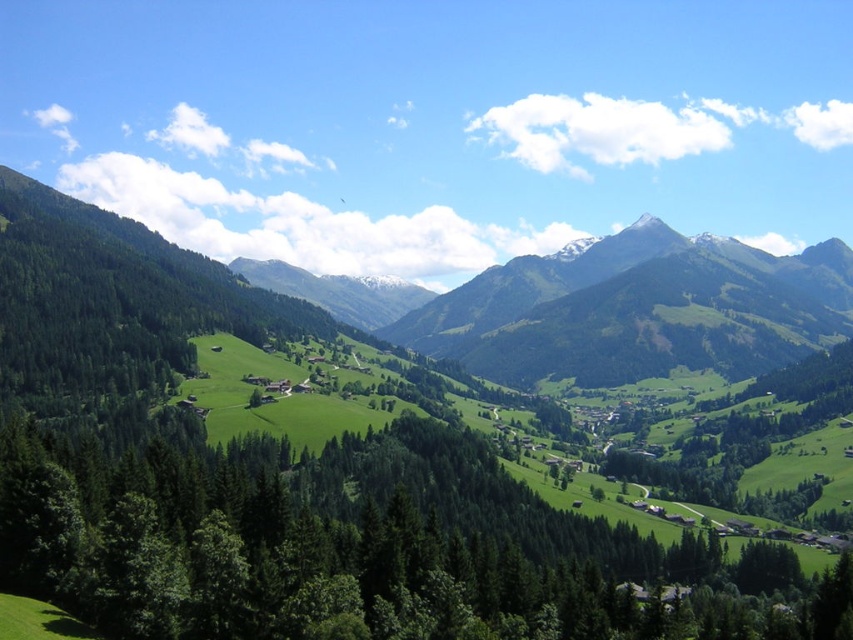
You are an outdoor enthusiast planning to hike through the mountainous landscape. You notice the green textured trees at center and the green grassy mountain at center. Which of these two features is closer to your current position?

The green textured trees at center are closer to your current position because they are positioned in front of the green grassy mountain at center.

Based on the photo, you are standing at the center of the image and want to reach the green grassy mountain at left. Which direction should you move to get there?

The green grassy mountain at left is located at point [297,484], so you should move to the left and slightly downward from the center to reach it.

You are planning a hiking trip and need to choose between two mountains in the scene. The green grassy mountain at left and the green grassy mountain at center. Based on their sizes, which one might require more stamina to climb?

The green grassy mountain at left is bigger than the green grassy mountain at center, so it might require more stamina to climb.